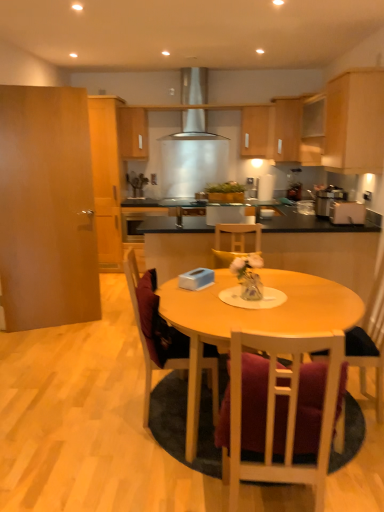
Question: Is wooden cabinet at upper center, which ranks as the 3th cabinetry in left-to-right order, shorter than wooden cabinet at upper center, which is the 4th cabinetry in left-to-right order?

Choices:
 (A) yes
 (B) no

Answer: (A)

Question: Is wooden cabinet at upper center, the sixth cabinetry from the right, directly adjacent to wooden cabinet at upper center, the fifth cabinetry when ordered from right to left?

Choices:
 (A) yes
 (B) no

Answer: (B)

Question: Is wooden cabinet at upper center, the sixth cabinetry from the right, outside wooden cabinet at upper center, which is the 4th cabinetry in left-to-right order?

Choices:
 (A) no
 (B) yes

Answer: (B)

Question: Does wooden cabinet at upper center, which ranks as the 3th cabinetry in left-to-right order, lie behind wooden cabinet at upper center, which is the 4th cabinetry in left-to-right order?

Choices:
 (A) no
 (B) yes

Answer: (B)

Question: Is wooden cabinet at upper center, the sixth cabinetry from the right, positioned with its back to wooden cabinet at upper center, the fifth cabinetry when ordered from right to left?

Choices:
 (A) no
 (B) yes

Answer: (A)

Question: In the image, is stainless steel exhaust hood at center positioned in front of or behind wooden cabinet at upper center, which is the 4th cabinetry in left-to-right order?

Choices:
 (A) behind
 (B) front

Answer: (B)

Question: Considering the positions of stainless steel exhaust hood at center and wooden cabinet at upper center, which is the 4th cabinetry in left-to-right order, in the image, is stainless steel exhaust hood at center taller or shorter than wooden cabinet at upper center, which is the 4th cabinetry in left-to-right order,?

Choices:
 (A) short
 (B) tall

Answer: (B)

Question: From the image's perspective, relative to wooden cabinet at upper center, which is the 4th cabinetry in left-to-right order, is stainless steel exhaust hood at center above or below?

Choices:
 (A) above
 (B) below

Answer: (A)

Question: Is stainless steel exhaust hood at center to the left or to the right of wooden cabinet at upper center, the fifth cabinetry when ordered from right to left, in the image?

Choices:
 (A) right
 (B) left

Answer: (B)

Question: In the image, is wooden cabinet at upper right, the 8th cabinetry in the left-to-right sequence, on the left side or the right side of matte silver sink at center?

Choices:
 (A) right
 (B) left

Answer: (A)

Question: In terms of height, does wooden cabinet at upper right, positioned as the first cabinetry in right-to-left order, look taller or shorter compared to matte silver sink at center?

Choices:
 (A) short
 (B) tall

Answer: (B)

Question: Is wooden cabinet at upper right, positioned as the first cabinetry in right-to-left order, spatially inside matte silver sink at center, or outside of it?

Choices:
 (A) outside
 (B) inside

Answer: (A)

Question: Is point (306, 124) closer or farther from the camera than point (137, 181)?

Choices:
 (A) closer
 (B) farther

Answer: (A)

Question: In terms of height, does wooden chair at right, the 3th chair viewed from the left, look taller or shorter compared to wooden cabinet at upper center, which ranks as the 3th cabinetry in left-to-right order?

Choices:
 (A) tall
 (B) short

Answer: (A)

Question: In terms of size, does wooden chair at right, arranged as the first chair when viewed from the right, appear bigger or smaller than wooden cabinet at upper center, the sixth cabinetry from the right?

Choices:
 (A) small
 (B) big

Answer: (B)